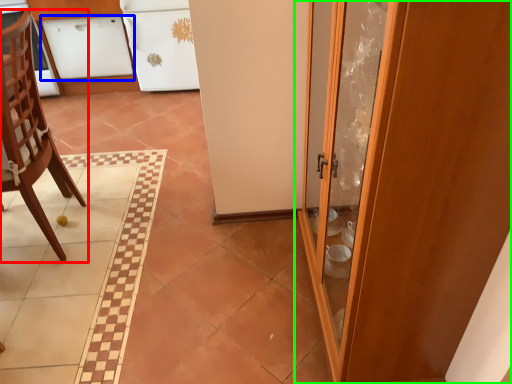
Question: Which is nearer to the chair (highlighted by a red box)? cabinetry (highlighted by a blue box) or door (highlighted by a green box).

Choices:
 (A) cabinetry
 (B) door

Answer: (B)